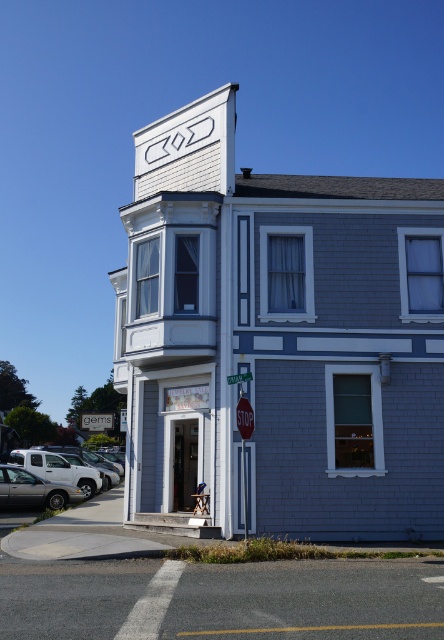
Does silver metallic sedan at lower left have a lesser height compared to red matte stop sign at center?

Incorrect, silver metallic sedan at lower left's height does not fall short of red matte stop sign at center's.

Who is taller, silver metallic sedan at lower left or red matte stop sign at center?

With more height is silver metallic sedan at lower left.

This screenshot has width=444, height=640. In order to click on silver metallic sedan at lower left in this screenshot , I will do `click(34, 490)`.

What are the coordinates of `silver metallic sedan at lower left` in the screenshot? It's located at (34, 490).

Which is more to the left, silver metallic truck at lower left or red matte stop sign at center?

From the viewer's perspective, silver metallic truck at lower left appears more on the left side.

Is silver metallic truck at lower left in front of red matte stop sign at center?

No, it is not.

Measure the distance between silver metallic truck at lower left and camera.

They are 26.38 meters apart.

At what (x,y) coordinates should I click in order to perform the action: click on silver metallic truck at lower left. Please return your answer as a coordinate pair (x, y). The width and height of the screenshot is (444, 640). Looking at the image, I should click on (66, 467).

Is gray brick building at center thinner than red matte stop sign at center?

No.

Does gray brick building at center have a greater width compared to red matte stop sign at center?

Correct, the width of gray brick building at center exceeds that of red matte stop sign at center.

Identify the location of gray brick building at center. The image size is (444, 640). (280, 339).

Where is `gray brick building at center`? The width and height of the screenshot is (444, 640). gray brick building at center is located at coordinates (280, 339).